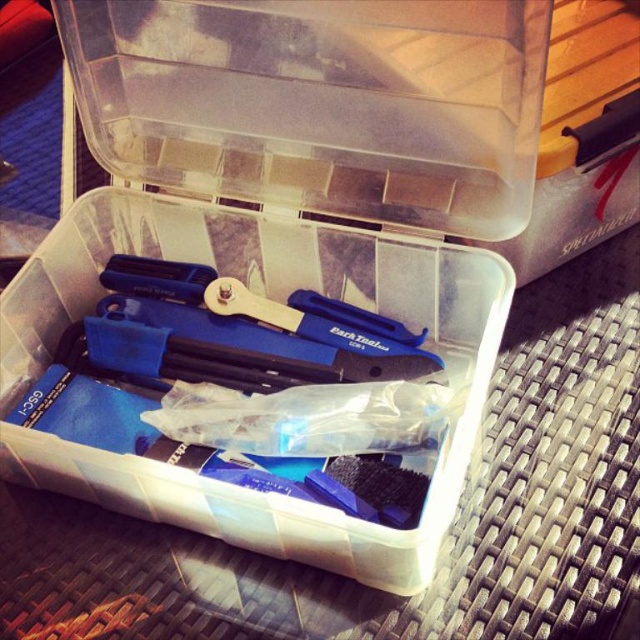
Question: Is transparent plastic container at center thinner than transparent plastic tools at center?

Choices:
 (A) no
 (B) yes

Answer: (A)

Question: Does transparent plastic container at center come in front of transparent plastic tools at center?

Choices:
 (A) no
 (B) yes

Answer: (B)

Question: Which point is closer to the camera?

Choices:
 (A) (340, 554)
 (B) (410, 198)

Answer: (A)

Question: Which object is farther from the camera taking this photo?

Choices:
 (A) transparent plastic tools at center
 (B) transparent plastic container at center

Answer: (A)

Question: Considering the relative positions of transparent plastic container at center and transparent plastic tools at center in the image provided, where is transparent plastic container at center located with respect to transparent plastic tools at center?

Choices:
 (A) left
 (B) right

Answer: (B)